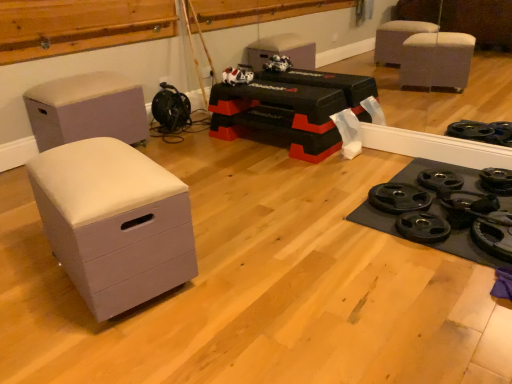
Question: Should I look upward or downward to see beige fabric ottoman at left?

Choices:
 (A) up
 (B) down

Answer: (A)

Question: Are beige fabric ottoman at left and white matte chest of drawers at left making contact?

Choices:
 (A) yes
 (B) no

Answer: (B)

Question: Is beige fabric ottoman at left outside white matte chest of drawers at left?

Choices:
 (A) no
 (B) yes

Answer: (B)

Question: Is beige fabric ottoman at left bigger than white matte chest of drawers at left?

Choices:
 (A) no
 (B) yes

Answer: (B)

Question: From a real-world perspective, is beige fabric ottoman at left positioned under white matte chest of drawers at left based on gravity?

Choices:
 (A) no
 (B) yes

Answer: (A)

Question: Would you say white matte chest of drawers at left is part of beige fabric ottoman at left's contents?

Choices:
 (A) yes
 (B) no

Answer: (B)

Question: From a real-world perspective, is beige fabric ottoman at left physically above white matte chest of drawers at left?

Choices:
 (A) yes
 (B) no

Answer: (A)

Question: From the image's perspective, is black rubber weight plate at lower right under white matte chest of drawers at left?

Choices:
 (A) yes
 (B) no

Answer: (B)

Question: Does black rubber weight plate at lower right have a greater height compared to white matte chest of drawers at left?

Choices:
 (A) yes
 (B) no

Answer: (B)

Question: From a real-world perspective, is black rubber weight plate at lower right positioned over white matte chest of drawers at left based on gravity?

Choices:
 (A) no
 (B) yes

Answer: (A)

Question: From a real-world perspective, is black rubber weight plate at lower right positioned under white matte chest of drawers at left based on gravity?

Choices:
 (A) no
 (B) yes

Answer: (B)

Question: Can you confirm if black rubber weight plate at lower right is smaller than white matte chest of drawers at left?

Choices:
 (A) yes
 (B) no

Answer: (A)

Question: Is black rubber weight plate at lower right positioned in front of white matte chest of drawers at left?

Choices:
 (A) yes
 (B) no

Answer: (B)

Question: From the image's perspective, would you say black rubber weight plate at lower right is shown under beige fabric ottoman at left?

Choices:
 (A) no
 (B) yes

Answer: (B)